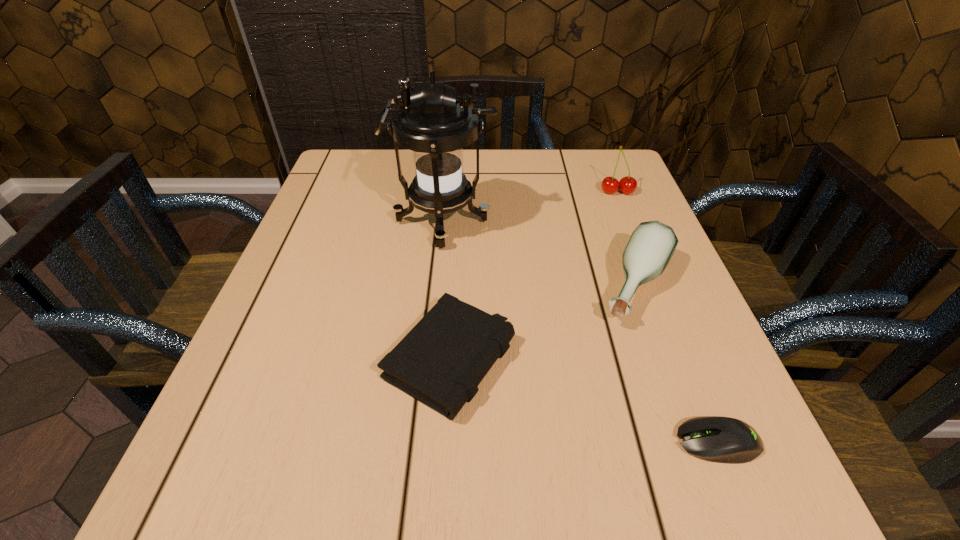
Locate an element on the screen. The image size is (960, 540). vacant region at the far edge of the desktop is located at coordinates (557, 157).

In the image, there is a desktop. Find the location of `vacant region at the near edge`. vacant region at the near edge is located at coordinates (322, 516).

This screenshot has width=960, height=540. I want to click on free space at the left edge of the desktop, so click(338, 199).

Where is `free space at the right edge of the desktop`? free space at the right edge of the desktop is located at coordinates (593, 248).

This screenshot has height=540, width=960. I want to click on vacant area at the far left corner, so click(x=328, y=194).

In the image, there is a desktop. Where is `vacant space at the far right corner`? vacant space at the far right corner is located at coordinates (601, 178).

Locate an element on the screen. vacant space at the near right corner is located at coordinates (777, 506).

You are a GUI agent. You are given a task and a screenshot of the screen. Output one action in this format:
    pyautogui.click(x=<x>, y=<y>)
    Task: Click on the free spot between the computer mouse and the Bible
    The height and width of the screenshot is (540, 960).
    Given the screenshot: What is the action you would take?
    pyautogui.click(x=584, y=401)

I want to click on blank region between the computer mouse and the lantern, so click(581, 332).

At what (x,y) coordinates should I click in order to perform the action: click on vacant space that is in between the third shortest object and the fourth tallest object. Please return your answer as a coordinate pair (x, y). Looking at the image, I should click on (544, 323).